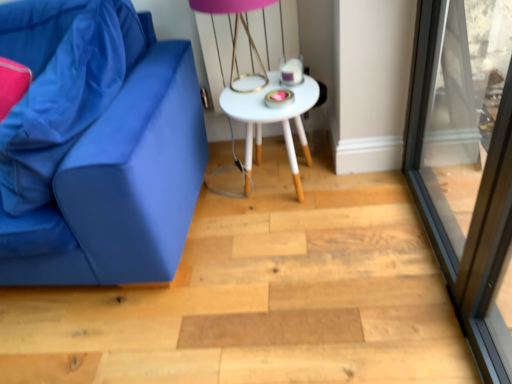
Question: Is white matte table at center inside matte blue couch at left?

Choices:
 (A) no
 (B) yes

Answer: (A)

Question: Does matte blue couch at left have a greater height compared to white matte table at center?

Choices:
 (A) yes
 (B) no

Answer: (A)

Question: Does matte blue couch at left come in front of white matte table at center?

Choices:
 (A) yes
 (B) no

Answer: (A)

Question: Is matte blue couch at left oriented towards white matte table at center?

Choices:
 (A) yes
 (B) no

Answer: (B)

Question: Is white matte table at center at the back of matte blue couch at left?

Choices:
 (A) yes
 (B) no

Answer: (B)

Question: Relative to pink matte table lamp at upper center, is transparent glass screen door at right in front or behind?

Choices:
 (A) front
 (B) behind

Answer: (A)

Question: In terms of size, does transparent glass screen door at right appear bigger or smaller than pink matte table lamp at upper center?

Choices:
 (A) small
 (B) big

Answer: (B)

Question: From a real-world perspective, is transparent glass screen door at right above or below pink matte table lamp at upper center?

Choices:
 (A) below
 (B) above

Answer: (A)

Question: Considering the positions of transparent glass screen door at right and pink matte table lamp at upper center in the image, is transparent glass screen door at right wider or thinner than pink matte table lamp at upper center?

Choices:
 (A) wide
 (B) thin

Answer: (B)

Question: In the image, is transparent glass screen door at right on the left side or the right side of matte blue fabric pillow at left?

Choices:
 (A) right
 (B) left

Answer: (A)

Question: In the image, is transparent glass screen door at right positioned in front of or behind matte blue fabric pillow at left?

Choices:
 (A) front
 (B) behind

Answer: (A)

Question: Is transparent glass screen door at right situated inside matte blue fabric pillow at left or outside?

Choices:
 (A) outside
 (B) inside

Answer: (A)

Question: Does point (459, 16) appear closer or farther from the camera than point (42, 117)?

Choices:
 (A) farther
 (B) closer

Answer: (A)

Question: From the image's perspective, is pink matte table lamp at upper center positioned above or below white matte table at center?

Choices:
 (A) below
 (B) above

Answer: (B)

Question: Relative to white matte table at center, is pink matte table lamp at upper center in front or behind?

Choices:
 (A) behind
 (B) front

Answer: (B)